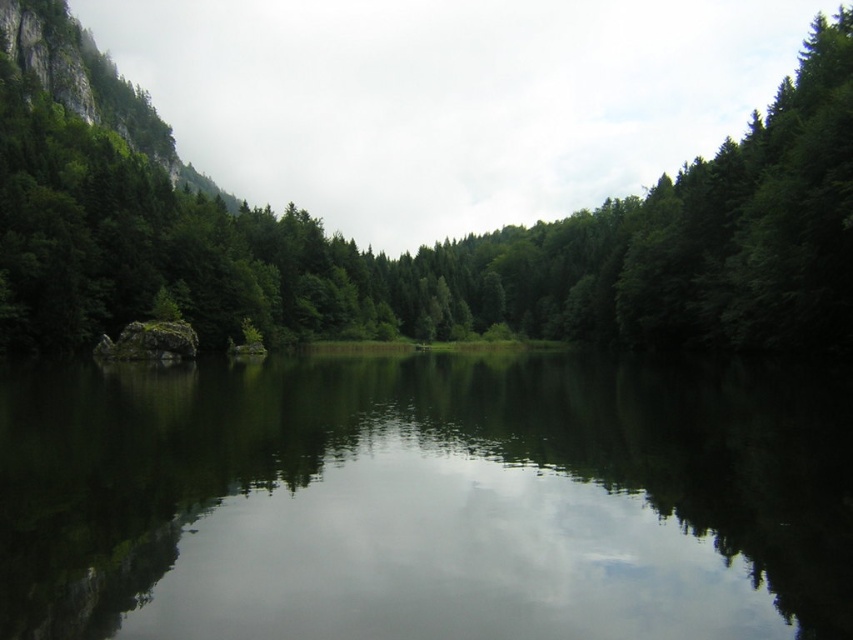
Question: Which point is farther to the camera?

Choices:
 (A) green matte tree at center
 (B) green reflective water at center

Answer: (A)

Question: Is green reflective water at center bigger than green matte tree at center?

Choices:
 (A) no
 (B) yes

Answer: (A)

Question: Is green reflective water at center in front of green matte tree at center?

Choices:
 (A) yes
 (B) no

Answer: (A)

Question: Considering the relative positions of green reflective water at center and green matte tree at center in the image provided, where is green reflective water at center located with respect to green matte tree at center?

Choices:
 (A) above
 (B) below

Answer: (B)